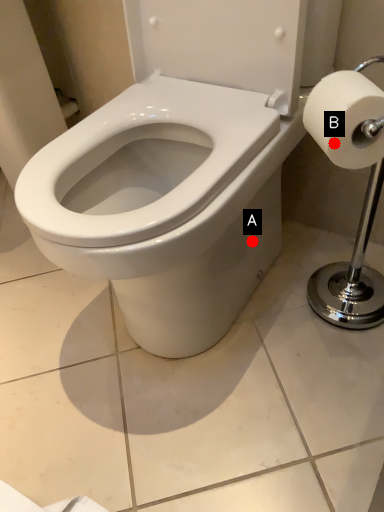
Question: Two points are circled on the image, labeled by A and B beside each circle. Which point is closer to the camera taking this photo?

Choices:
 (A) A is closer
 (B) B is closer

Answer: (B)